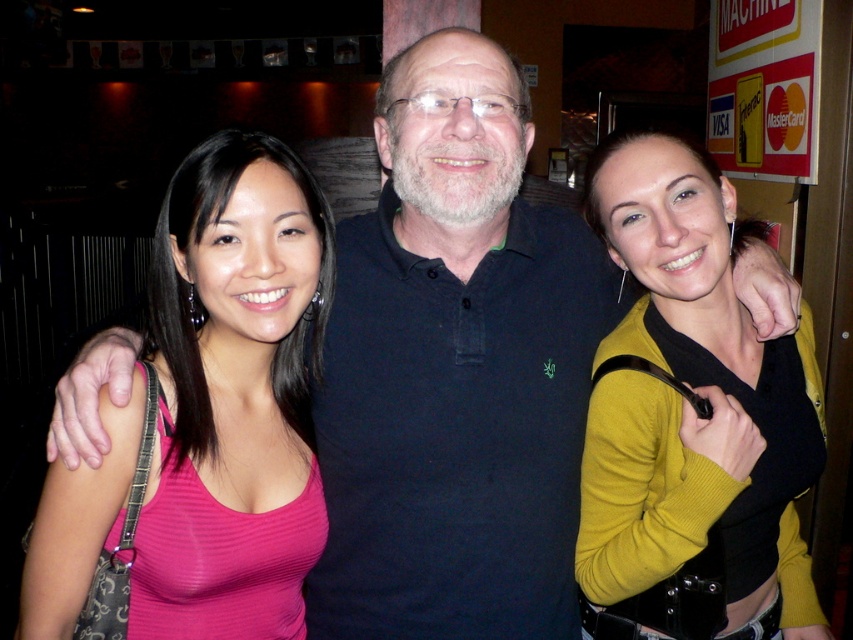
Which is behind, point (61, 504) or point (672, 324)?

The point (672, 324) is more distant.

Does pink ribbed tank top at left have a greater height compared to mustard yellow sweater at center?

No.

This screenshot has height=640, width=853. Find the location of `pink ribbed tank top at left`. pink ribbed tank top at left is located at coordinates (234, 394).